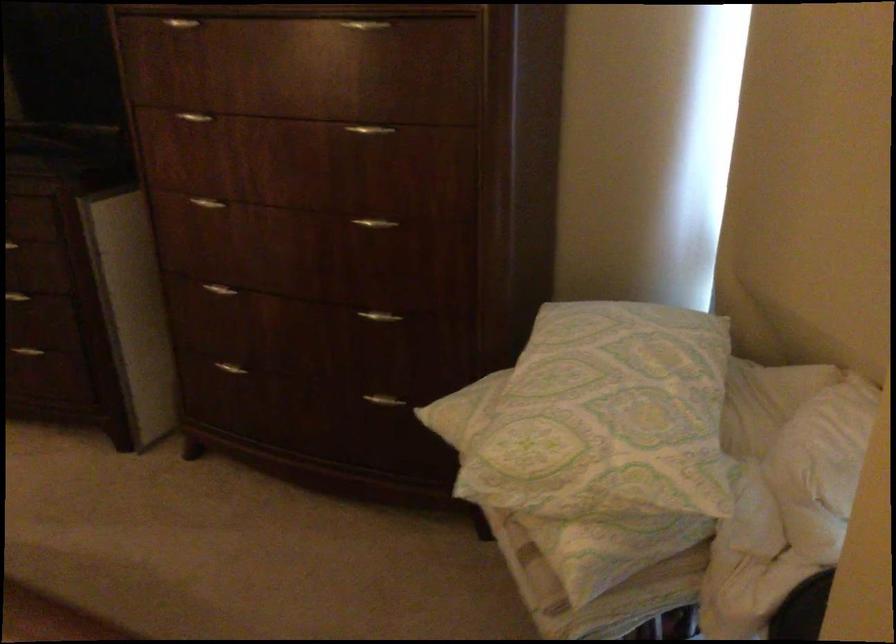
Where would you lift the patterned pillow? Please return your answer as a coordinate pair (x, y).

(607, 415)